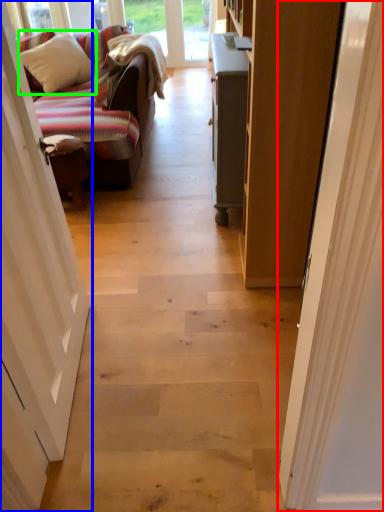
Question: Considering the real-world distances, which object is closest to door (highlighted by a red box)? door (highlighted by a blue box) or pillow (highlighted by a green box).

Choices:
 (A) door
 (B) pillow

Answer: (A)